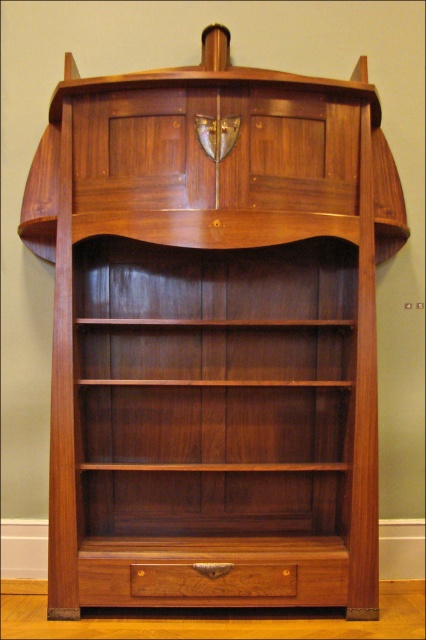
Does brown wood drawer at lower center have a lesser height compared to polished wood drawer at lower center?

In fact, brown wood drawer at lower center may be taller than polished wood drawer at lower center.

Is brown wood drawer at lower center taller than polished wood drawer at lower center?

Yes, brown wood drawer at lower center is taller than polished wood drawer at lower center.

Which is in front, point (123, 582) or point (173, 586)?

Point (123, 582) is more forward.

This screenshot has height=640, width=426. In order to click on brown wood drawer at lower center in this screenshot , I will do pos(213,572).